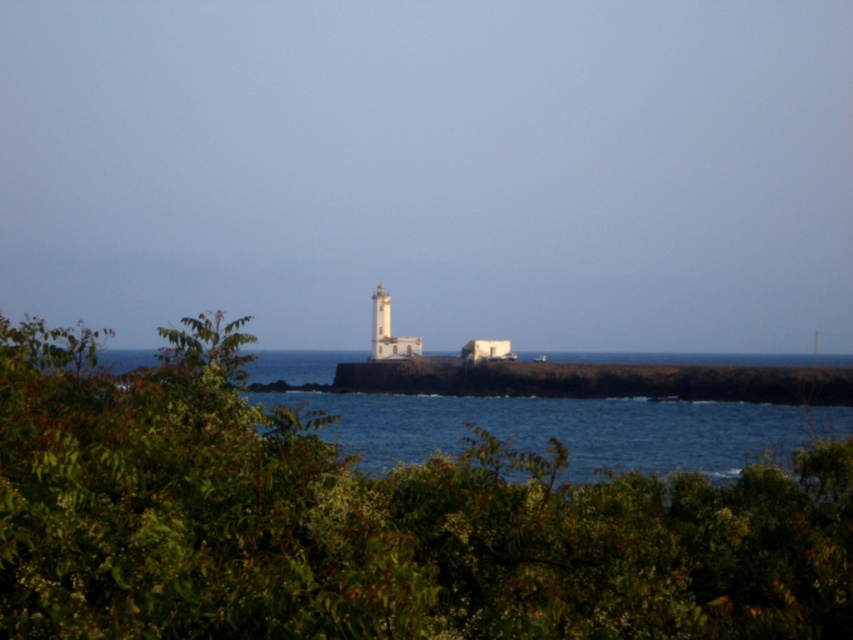
You are standing at the center of the image and want to walk towards the lighthouse. Is the green leafy shrub at center in your path?

The green leafy shrub at center is located at point (370, 522) in the image, so it is in your path towards the lighthouse.